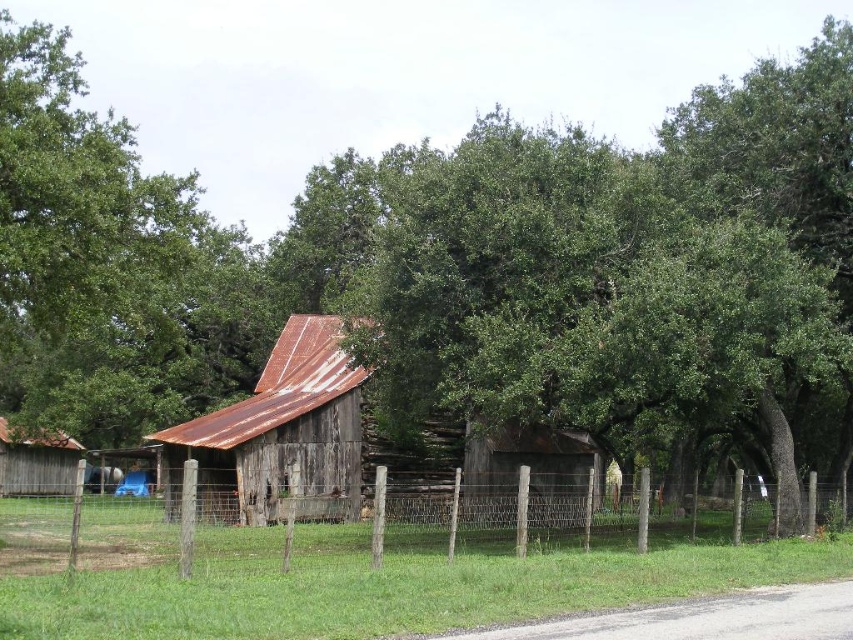
Question: Which of the following is the closest to the observer?

Choices:
 (A) wooden fence at center
 (B) rusty wood barn at center

Answer: (A)

Question: In this image, where is green leafy tree at upper left located relative to rusty wood barn at center?

Choices:
 (A) right
 (B) left

Answer: (B)

Question: Among these points, which one is farthest from the camera?

Choices:
 (A) (236, 416)
 (B) (80, 264)
 (C) (339, 529)
 (D) (4, 483)

Answer: (D)

Question: Observing the image, what is the correct spatial positioning of wooden fence at center in reference to rusty wood barn at left?

Choices:
 (A) below
 (B) above

Answer: (A)

Question: Does rusty wood barn at center have a lesser width compared to rusty wood barn at left?

Choices:
 (A) yes
 (B) no

Answer: (A)

Question: Estimate the real-world distances between objects in this image. Which object is farther from the green leafy tree at upper left?

Choices:
 (A) rusty wood barn at left
 (B) rusty wood barn at center

Answer: (B)